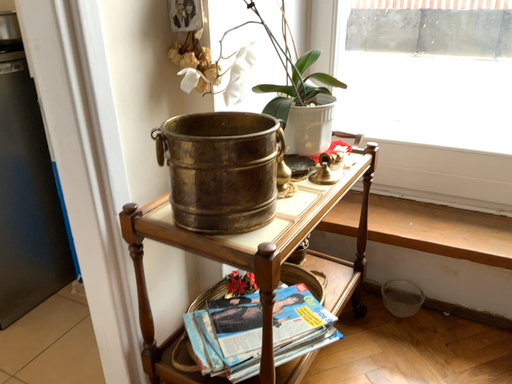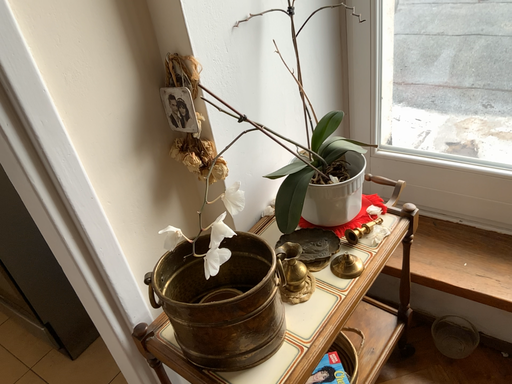
Question: Which way did the camera rotate in the video?

Choices:
 (A) rotated right
 (B) rotated left

Answer: (B)